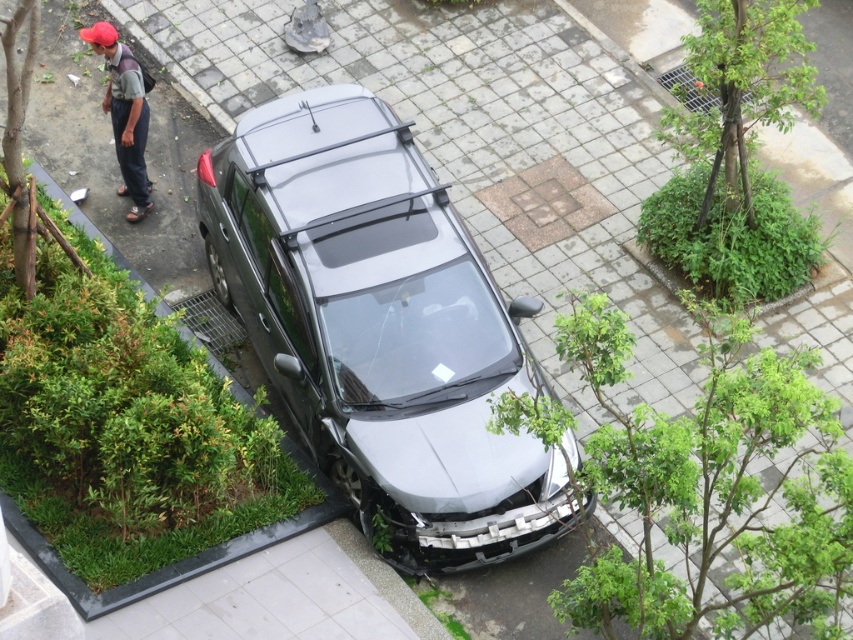
You are a pedestrian standing at the edge of the paved area. You see the satin black car at center and the matte red cap at upper left. Which object is closer to you?

The matte red cap at upper left is closer to you because it is positioned above the satin black car at center, which is further away.

Consider the image. You are a delivery drone that needs to fly over the satin black car at center and the matte red cap at upper left. Given your height requirement, which object do you need to avoid due to its height?

The satin black car at center has a greater height compared to the matte red cap at upper left, so the drone should avoid flying over the satin black car at center due to its height.